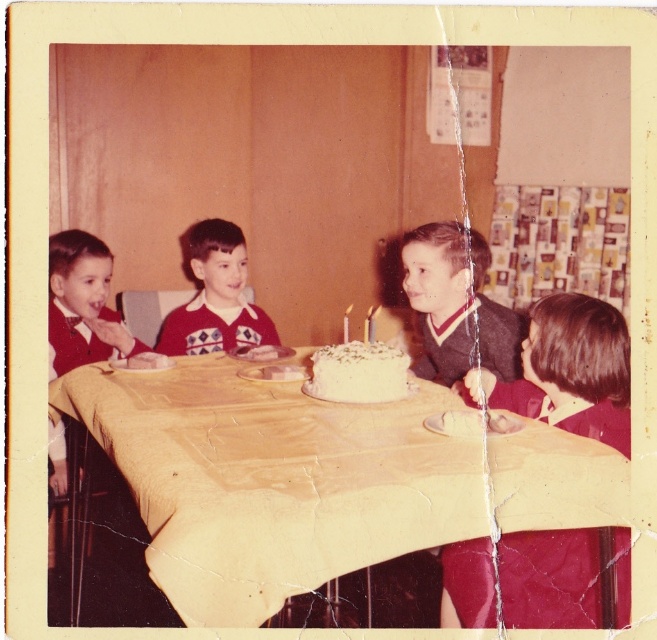
Question: Among these points, which one is farthest from the camera?

Choices:
 (A) (328, 381)
 (B) (532, 330)
 (C) (348, 321)

Answer: (C)

Question: Which object is the closest to the white frosted cake at center?

Choices:
 (A) dark brown hair at right
 (B) matte red sweater at center
 (C) white wax candle at center

Answer: (A)

Question: From the image, what is the correct spatial relationship of yellow paper tablecloth at center in relation to dark brown hair at right?

Choices:
 (A) below
 (B) above

Answer: (B)

Question: Based on their relative distances, which object is farther from the dark brown hair at right?

Choices:
 (A) yellow paper tablecloth at center
 (B) matte red sweater at center

Answer: (B)

Question: Is yellow paper tablecloth at center wider than white frosted cake at center?

Choices:
 (A) no
 (B) yes

Answer: (B)

Question: Can you confirm if dark gray sweater at center is smaller than white wax candle at center?

Choices:
 (A) no
 (B) yes

Answer: (A)